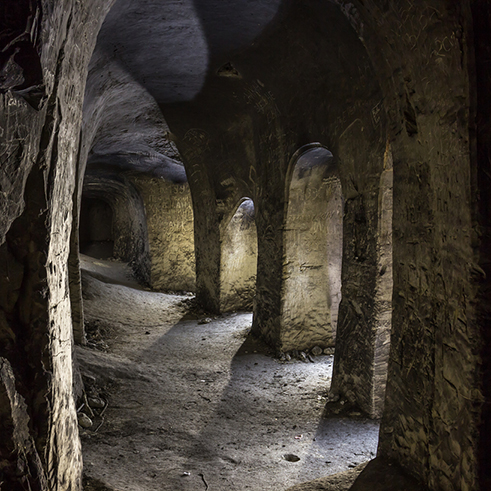
Locate an element on the screen. This screenshot has width=491, height=491. edge of left wall is located at coordinates (66, 164).